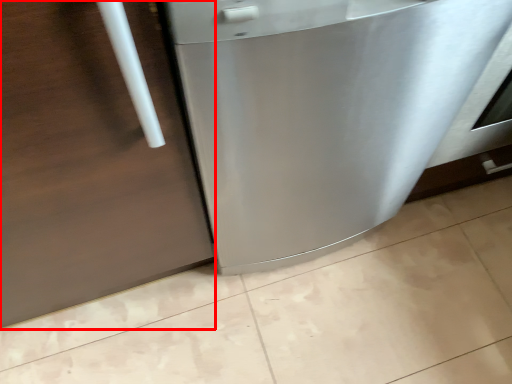
Question: Where is door (annotated by the red box) located in relation to home appliance in the image?

Choices:
 (A) left
 (B) right

Answer: (A)